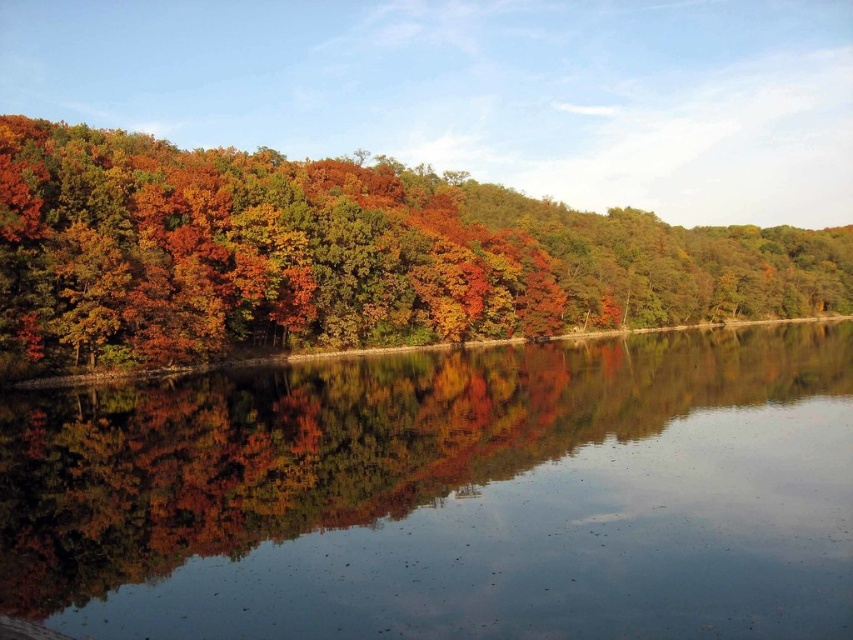
Question: Is transparent water at center positioned behind autumn leaves at left?

Choices:
 (A) no
 (B) yes

Answer: (A)

Question: Can you confirm if transparent water at center is positioned to the left of autumn leaves at left?

Choices:
 (A) yes
 (B) no

Answer: (A)

Question: Which of the following is the closest to the observer?

Choices:
 (A) transparent water at center
 (B) autumn leaves at left

Answer: (A)

Question: Can you confirm if transparent water at center is wider than autumn leaves at left?

Choices:
 (A) yes
 (B) no

Answer: (B)

Question: Which point is farther to the camera?

Choices:
 (A) (361, 195)
 (B) (22, 541)

Answer: (A)